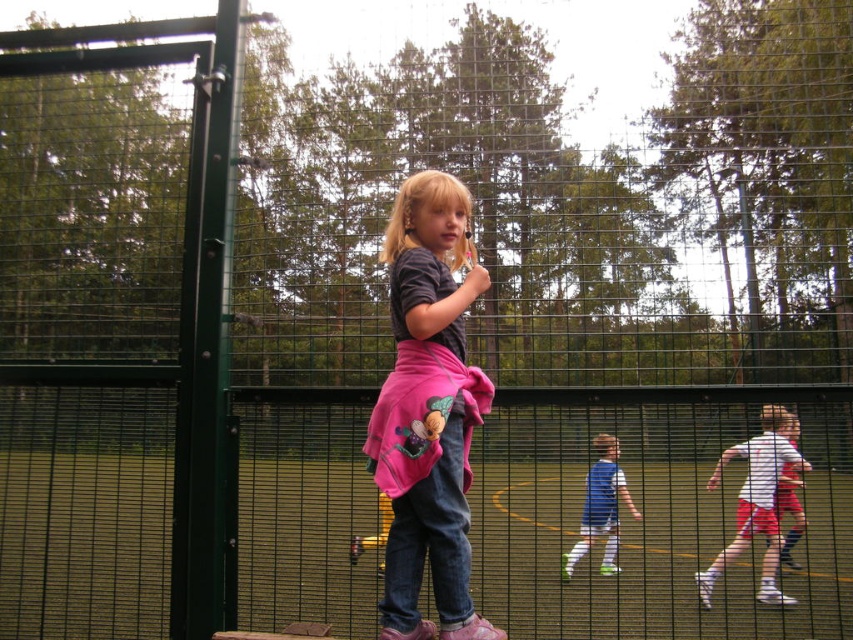
Who is higher up, pink fabric skirt at center or blue jersey at center?

pink fabric skirt at center is higher up.

Between pink fabric skirt at center and blue jersey at center, which one is positioned lower?

blue jersey at center

Who is more distant from viewer, (407, 365) or (582, 534)?

The point (582, 534) is more distant.

You are a GUI agent. You are given a task and a screenshot of the screen. Output one action in this format:
    pyautogui.click(x=<x>, y=<y>)
    Task: Click on the pink fabric skirt at center
    
    Given the screenshot: What is the action you would take?
    pyautogui.click(x=428, y=410)

Can you confirm if white matte shirt at center is taller than white cotton shirt at right?

Yes, white matte shirt at center is taller than white cotton shirt at right.

Is white matte shirt at center above white cotton shirt at right?

Yes.

Between point (747, 497) and point (788, 490), which one is positioned in front?

Point (747, 497)

Identify the location of white matte shirt at center. (757, 500).

What do you see at coordinates (428, 410) in the screenshot?
I see `pink fabric skirt at center` at bounding box center [428, 410].

How distant is pink fabric skirt at center from white cotton shirt at right?

pink fabric skirt at center is 8.81 feet away from white cotton shirt at right.

Who is more distant from viewer, (422, 228) or (776, 493)?

The point (776, 493) is behind.

This screenshot has width=853, height=640. I want to click on pink fabric skirt at center, so click(428, 410).